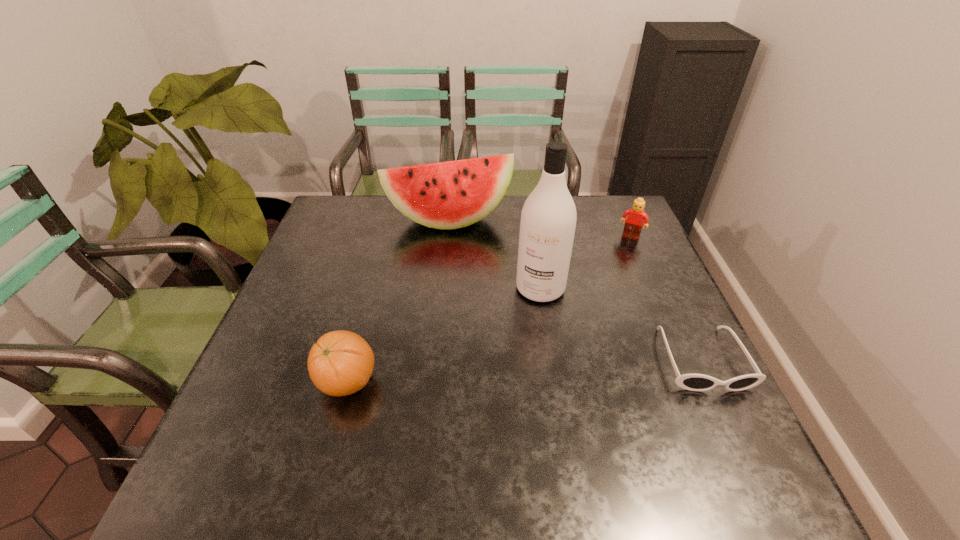
I want to click on free area in between the tallest object and the orange, so click(x=444, y=335).

The width and height of the screenshot is (960, 540). In order to click on object that is the second nearest to the sunglasses in this screenshot , I will do tap(637, 216).

This screenshot has width=960, height=540. Identify the location of the fourth closest object to the orange. (637, 216).

Identify the location of free space that satisfies the following two spatial constraints: 1. on the back side of the orange; 2. on the left side of the Lego. (386, 237).

Identify the location of blank area in the image that satisfies the following two spatial constraints: 1. on the back side of the Lego; 2. on the right side of the orange. tap(386, 237).